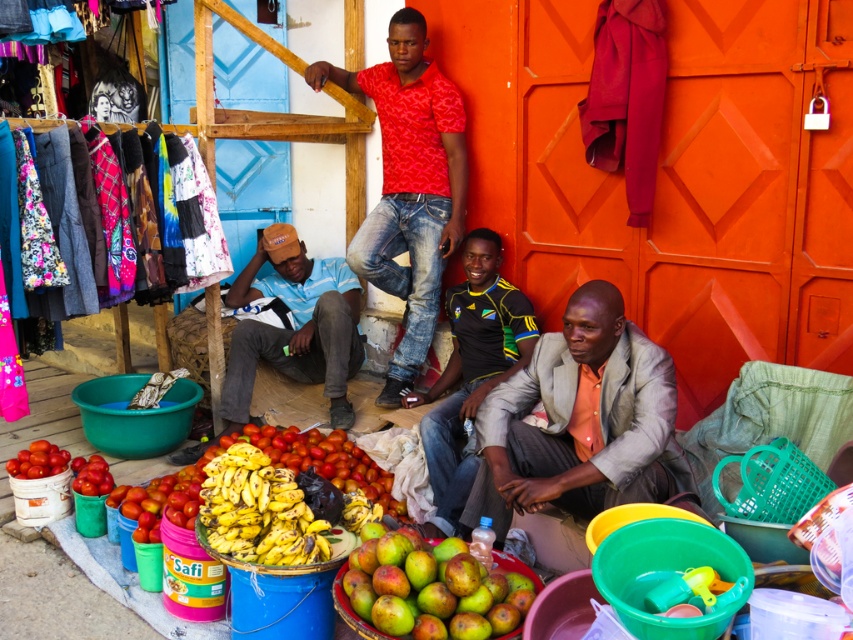
Does orange fabric jacket at lower center have a lesser width compared to red printed shirt at center?

Yes, orange fabric jacket at lower center is thinner than red printed shirt at center.

What do you see at coordinates (579, 420) in the screenshot? I see `orange fabric jacket at lower center` at bounding box center [579, 420].

Where is `orange fabric jacket at lower center`? The height and width of the screenshot is (640, 853). orange fabric jacket at lower center is located at coordinates (579, 420).

Is brown cotton cap at lower left wider than shiny yellow bananas at center?

Correct, the width of brown cotton cap at lower left exceeds that of shiny yellow bananas at center.

Where is `brown cotton cap at lower left`? The width and height of the screenshot is (853, 640). brown cotton cap at lower left is located at coordinates (291, 330).

Measure the distance between orange fabric jacket at lower center and shiny red tomatoes at lower left.

orange fabric jacket at lower center and shiny red tomatoes at lower left are 2.24 meters apart from each other.

Is orange fabric jacket at lower center shorter than shiny red tomatoes at lower left?

Incorrect, orange fabric jacket at lower center's height does not fall short of shiny red tomatoes at lower left's.

This screenshot has height=640, width=853. In order to click on orange fabric jacket at lower center in this screenshot , I will do `click(579, 420)`.